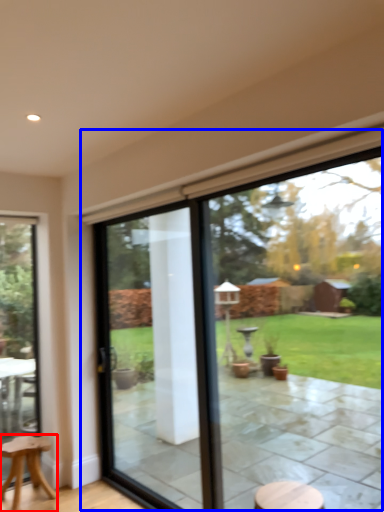
Question: Which object appears closest to the camera in this image, stool (highlighted by a red box) or window (highlighted by a blue box)?

Choices:
 (A) stool
 (B) window

Answer: (B)